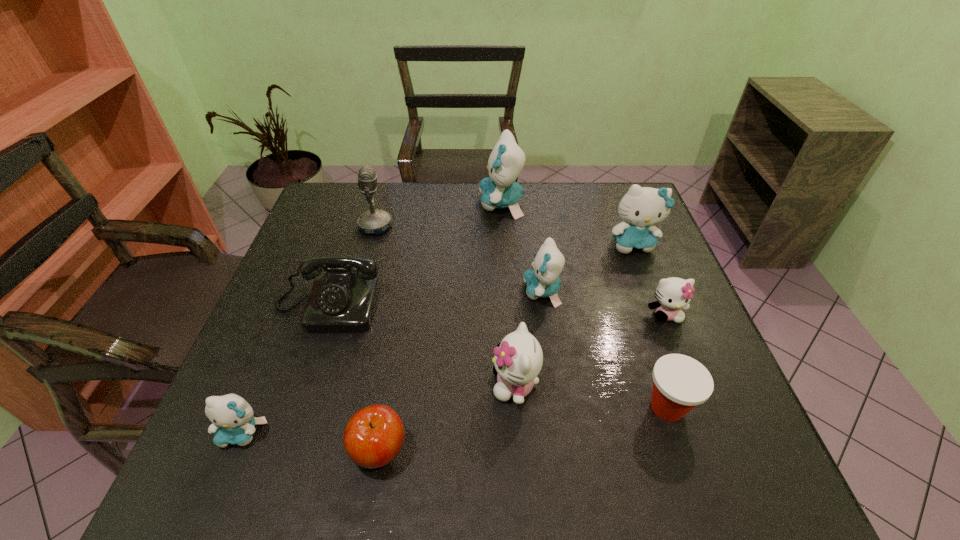
Locate an element on the screen. This screenshot has width=960, height=540. free space located on the face of the third farthest blue kitten is located at coordinates (412, 292).

I want to click on vacant space situated on the face of the third farthest blue kitten, so click(x=496, y=292).

You are a GUI agent. You are given a task and a screenshot of the screen. Output one action in this format:
    pyautogui.click(x=<x>, y=<y>)
    Task: Click on the vacant space positioned on the face of the third farthest blue kitten
    The width and height of the screenshot is (960, 540).
    Given the screenshot: What is the action you would take?
    pyautogui.click(x=489, y=292)

The image size is (960, 540). What are the coordinates of `free location located 0.250m on the front-facing side of the fifth farthest kitten` in the screenshot? It's located at click(374, 384).

Locate an element on the screen. vacant space located on the front-facing side of the fifth farthest kitten is located at coordinates (421, 384).

Locate an element on the screen. The image size is (960, 540). vacant position located on the front-facing side of the fifth farthest kitten is located at coordinates (371, 384).

Identify the location of free space located on the dial of the telephone. The image size is (960, 540). (287, 429).

Where is `free space located 0.350m on the front-facing side of the right white kitten`? The width and height of the screenshot is (960, 540). free space located 0.350m on the front-facing side of the right white kitten is located at coordinates (730, 473).

Where is `vacant region located on the right of the seventh object from right to left`? Image resolution: width=960 pixels, height=540 pixels. vacant region located on the right of the seventh object from right to left is located at coordinates (570, 450).

Identify the location of blank area located 0.230m on the back of the red-orange Dixie cup. (633, 306).